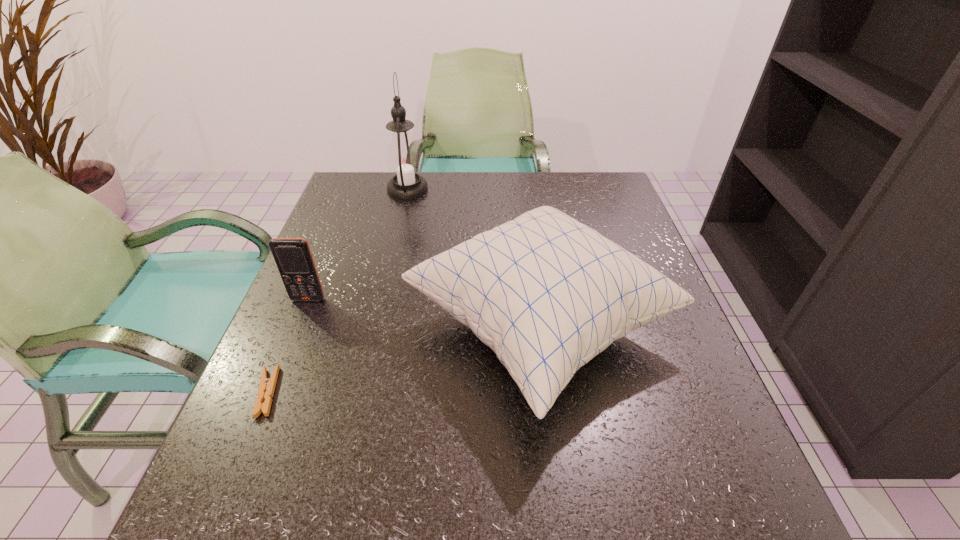
I want to click on free location at the far right corner, so click(x=617, y=208).

The height and width of the screenshot is (540, 960). I want to click on free area in between the cellular telephone and the oil lamp, so click(358, 244).

Locate an element on the screen. The image size is (960, 540). blank region between the second shortest object and the shortest object is located at coordinates (288, 346).

At what (x,y) coordinates should I click in order to perform the action: click on free space between the second shortest object and the shortest object. Please return your answer as a coordinate pair (x, y). Looking at the image, I should click on (288, 346).

The width and height of the screenshot is (960, 540). In order to click on free spot between the clothespin and the second shortest object in this screenshot , I will do `click(288, 346)`.

The width and height of the screenshot is (960, 540). I want to click on vacant space in between the shortest object and the second tallest object, so click(403, 360).

This screenshot has width=960, height=540. I want to click on free space between the cellular telephone and the oil lamp, so click(358, 244).

The image size is (960, 540). I want to click on vacant space that's between the cushion and the third tallest object, so click(x=423, y=313).

Image resolution: width=960 pixels, height=540 pixels. Identify the location of free spot between the clothespin and the third object from left to right. (338, 291).

Choose which object is the second nearest neighbor to the rightmost object. Please provide its 2D coordinates. Your answer should be formatted as a tuple, i.e. [(x, y)], where the tuple contains the x and y coordinates of a point satisfying the conditions above.

[(404, 161)]